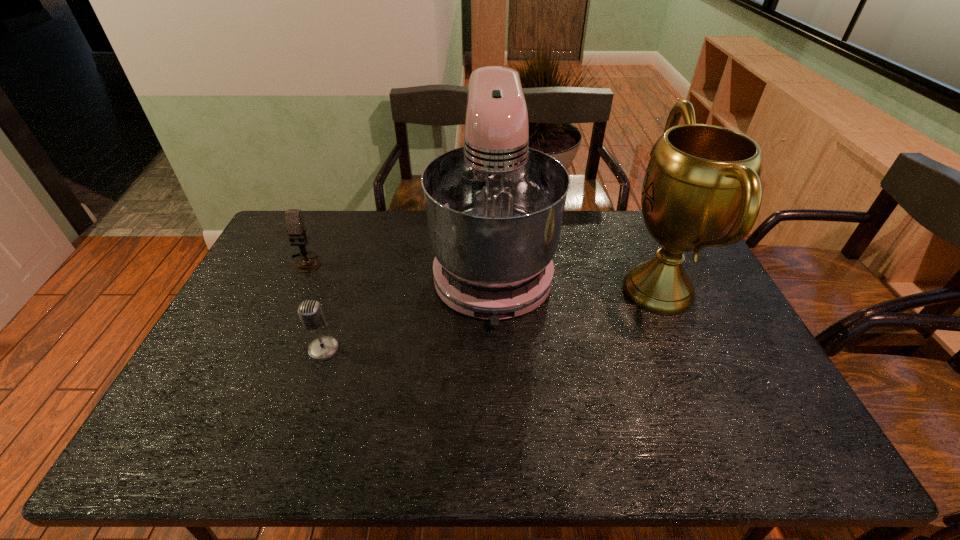
Image resolution: width=960 pixels, height=540 pixels. Find the location of `the third object from left to right`. the third object from left to right is located at coordinates click(494, 208).

At what (x,y) coordinates should I click in order to perform the action: click on trophy cup. Please return your answer as a coordinate pair (x, y). The image size is (960, 540). Looking at the image, I should click on (702, 188).

Where is `the farther microphone`? The height and width of the screenshot is (540, 960). the farther microphone is located at coordinates (296, 230).

The height and width of the screenshot is (540, 960). I want to click on the leftmost object, so click(x=296, y=230).

Image resolution: width=960 pixels, height=540 pixels. What are the coordinates of `the right microphone` in the screenshot? It's located at (310, 312).

In order to click on the second object from left to right in this screenshot , I will do 310,312.

I want to click on free space located 0.050m on the front-facing side of the mixer, so click(495, 348).

Where is `free space located 0.240m on the surface of the rightmost object with symbols`? This screenshot has width=960, height=540. free space located 0.240m on the surface of the rightmost object with symbols is located at coordinates click(x=540, y=291).

Identify the location of vacant point located 0.080m on the surface of the rightmost object with symbols. (591, 291).

Identify the location of free space located 0.060m on the surface of the rightmost object with symbols. (597, 291).